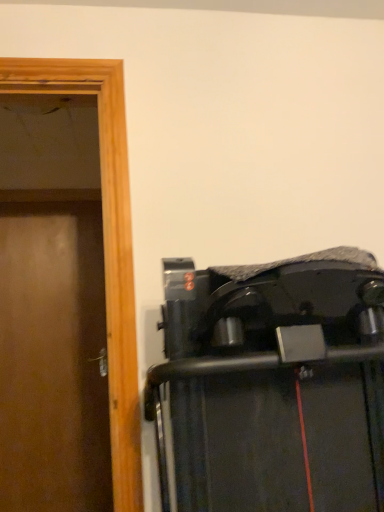
The width and height of the screenshot is (384, 512). What do you see at coordinates (273, 385) in the screenshot? I see `black matte film camera at right` at bounding box center [273, 385].

Find the location of a particular element. Image resolution: width=384 pixels, height=512 pixels. black matte film camera at right is located at coordinates (273, 385).

Find the location of `black matte film camera at right`. black matte film camera at right is located at coordinates (273, 385).